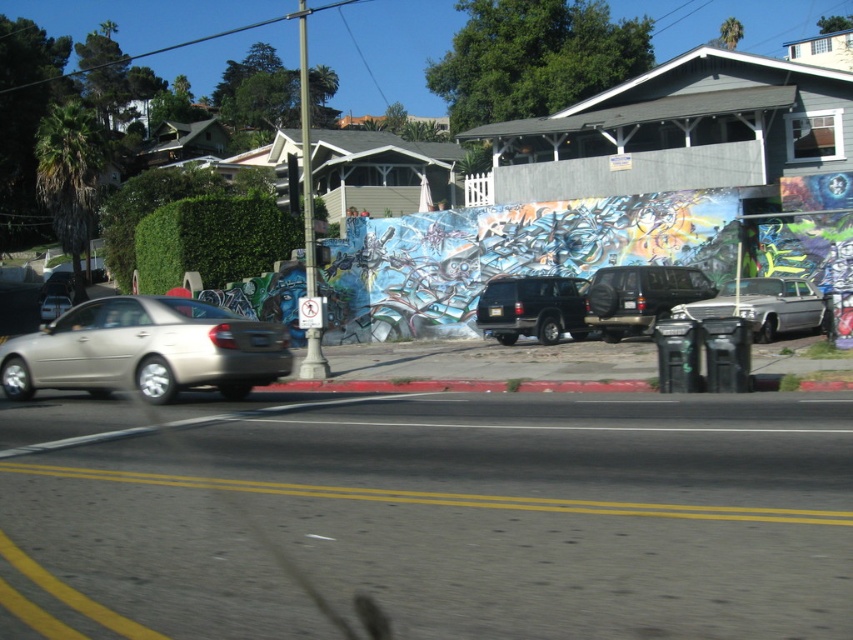
Question: Is satin gold sedan at center to the right of matte black suv at center from the viewer's perspective?

Choices:
 (A) yes
 (B) no

Answer: (B)

Question: Does matte black suv at center come behind silver metallic car at right?

Choices:
 (A) yes
 (B) no

Answer: (A)

Question: Which of the following is the closest to the observer?

Choices:
 (A) silver metallic car at right
 (B) matte black suv at center
 (C) satin gold sedan at center

Answer: (C)

Question: Considering the real-world distances, which object is closest to the satin gold sedan at center?

Choices:
 (A) matte black suv at center
 (B) silver metallic car at right

Answer: (A)

Question: Which is farther from the satin gold sedan at center?

Choices:
 (A) matte black suv at center
 (B) silver metallic car at right
 (C) satin black suv at center

Answer: (B)

Question: Does matte black suv at center appear on the right side of satin black suv at center?

Choices:
 (A) yes
 (B) no

Answer: (A)